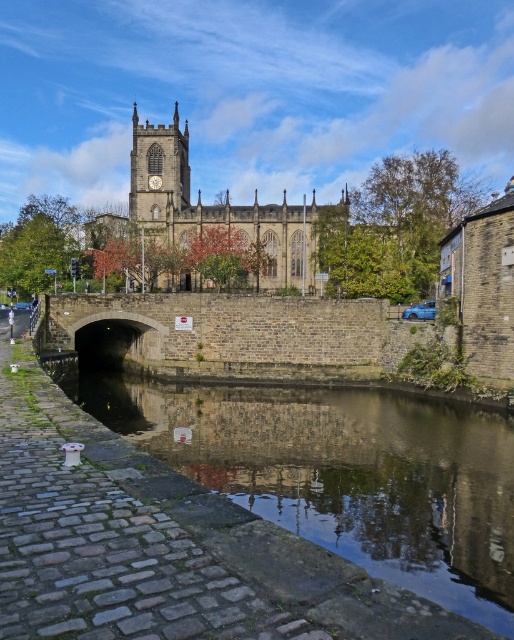
You are standing on the cobblestone path near the historic stone church and want to walk to both point (318,593) and point (174,157). Which point should you reach first if you want to minimize the distance walked?

You should reach point (318,593) first because it is closer to the viewer than point (174,157), so walking to it first would require less distance.

You are a tourist standing on the cobblestone path near the smooth stone river at lower left and the stone church at center. You want to cross the river to reach the church. Is the river narrow enough for you to jump across?

The smooth stone river at lower left is narrower than the stone church at center, so yes, the river is narrow enough to jump across.